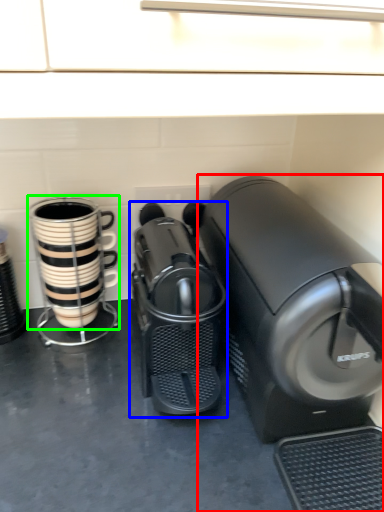
Question: Which object is the closest to the home appliance (highlighted by a red box)? Choose among these: home appliance (highlighted by a blue box) or coffee cup (highlighted by a green box).

Choices:
 (A) home appliance
 (B) coffee cup

Answer: (A)